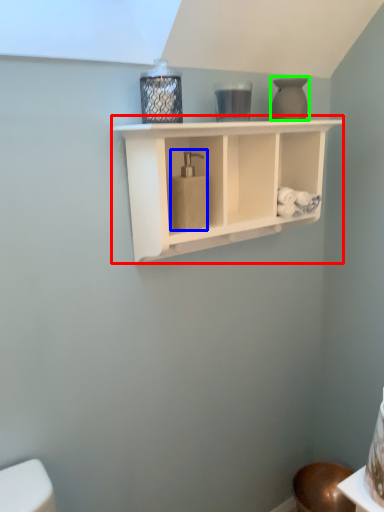
Question: Considering the real-world distances, which object is closest to shelf (highlighted by a red box)? soap dispenser (highlighted by a blue box) or vase (highlighted by a green box).

Choices:
 (A) soap dispenser
 (B) vase

Answer: (A)